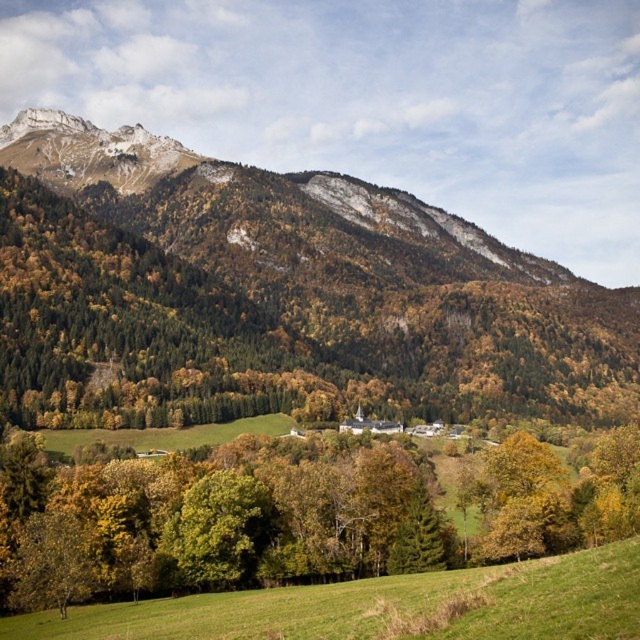
How much distance is there between green forested mountain at upper center and green matte tree at center?

green forested mountain at upper center is 120.71 meters away from green matte tree at center.

Where is `green forested mountain at upper center`? The image size is (640, 640). green forested mountain at upper center is located at coordinates (276, 289).

Where is `green forested mountain at upper center`? The height and width of the screenshot is (640, 640). green forested mountain at upper center is located at coordinates (276, 289).

Which is in front, point (428, 268) or point (364, 630)?

Point (364, 630)

Can you confirm if green forested mountain at upper center is thinner than green grassy field at lower center?

In fact, green forested mountain at upper center might be wider than green grassy field at lower center.

Find the location of a particular element. This screenshot has width=640, height=640. green forested mountain at upper center is located at coordinates (276, 289).

From the picture: Does green matte tree at center have a smaller size compared to green grassy field at lower center?

Actually, green matte tree at center might be larger than green grassy field at lower center.

Find the location of a particular element. The width and height of the screenshot is (640, 640). green matte tree at center is located at coordinates (296, 516).